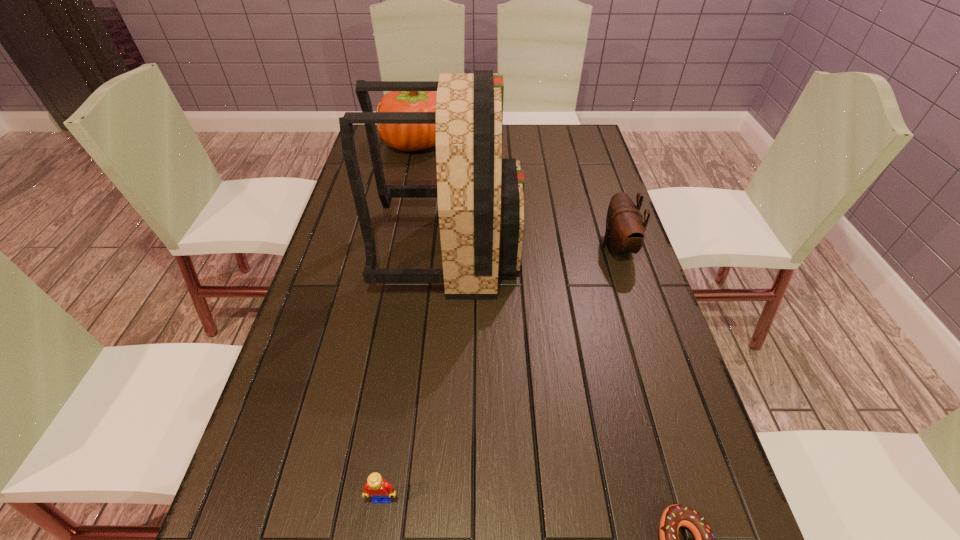
At what (x,y) coordinates should I click in order to perform the action: click on the tallest object. Please return your answer as a coordinate pair (x, y). Image resolution: width=960 pixels, height=540 pixels. Looking at the image, I should click on (480, 195).

Where is `the farthest object`? Image resolution: width=960 pixels, height=540 pixels. the farthest object is located at coordinates (406, 137).

The width and height of the screenshot is (960, 540). What are the coordinates of `pumpkin` in the screenshot? It's located at (406, 137).

Find the location of `the third tallest object`. the third tallest object is located at coordinates (625, 230).

Locate an element on the screen. The width and height of the screenshot is (960, 540). the second shortest object is located at coordinates (378, 489).

I want to click on the second nearest object, so click(x=378, y=489).

The width and height of the screenshot is (960, 540). What are the coordinates of `free spot located on the front face of the backpack` in the screenshot? It's located at (596, 248).

Locate an element on the screen. Image resolution: width=960 pixels, height=540 pixels. vacant space situated on the side of the farthest object with the cute face is located at coordinates (470, 143).

Find the location of a particular element. The width and height of the screenshot is (960, 540). free space located 0.250m with the flap open on the third shortest object is located at coordinates (514, 247).

Image resolution: width=960 pixels, height=540 pixels. In order to click on free space located with the flap open on the third shortest object in this screenshot , I will do `click(577, 247)`.